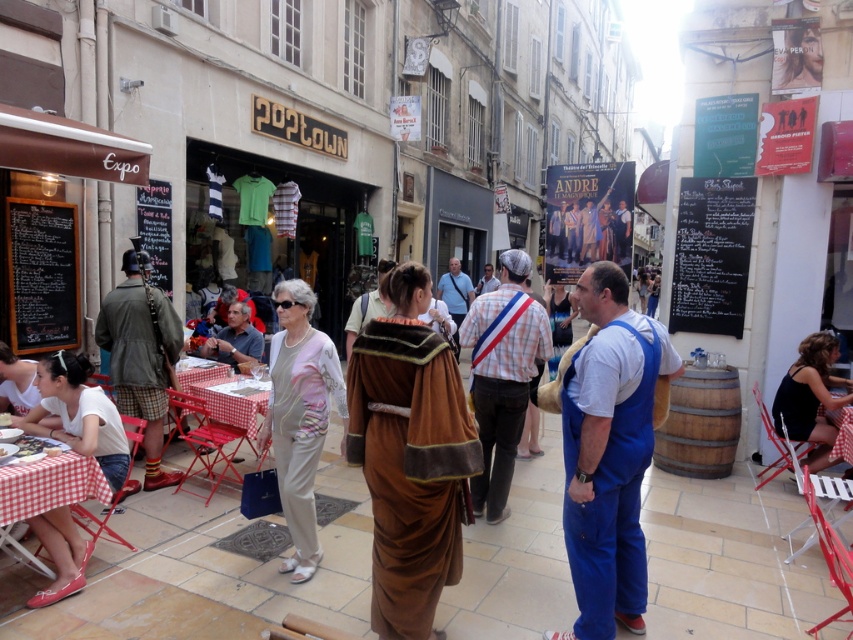
You are standing at the camera position and see two points in the scene. The first point is at coordinates point [425,381] and the second is at point [804,424]. Which point is closer to you?

Point [425,381] is closer to the camera than point [804,424].

Consider the image. You are a photographer trying to capture both the brown velvet robe at center and the black fabric dress at lower right in the same frame. Based on their positions, which one is closer to the camera?

The brown velvet robe at center is positioned under the black fabric dress at lower right, meaning it is closer to the camera.

You are standing in the lively European town street scene. You notice two points marked in the image. The first point is at coordinates point (108, 326) and the second is at point (16, 346). Which point is closer to you?

Point (108, 326) is closer to the viewer than point (16, 346).